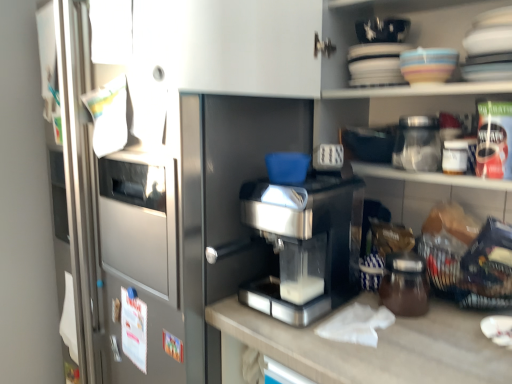
Question: From the image's perspective, relative to matte ceramic bowl at upper right, is transparent glass jar at upper right, placed as the second glass jar when sorted from bottom to top, above or below?

Choices:
 (A) above
 (B) below

Answer: (B)

Question: Looking at the image, does transparent glass jar at upper right, placed as the second glass jar when sorted from bottom to top, seem bigger or smaller compared to matte ceramic bowl at upper right?

Choices:
 (A) big
 (B) small

Answer: (A)

Question: Based on their relative distances, which object is farther from the brown glass jar at lower right, the second glass jar when ordered from top to bottom?

Choices:
 (A) matte ceramic bowl at upper right
 (B) transparent glass jar at upper right, placed as the second glass jar when sorted from bottom to top
 (C) sleek metallic coffee machine at center

Answer: (A)

Question: Based on their relative distances, which object is nearer to the brown glass jar at lower right, which is counted as the 1th glass jar, starting from the bottom?

Choices:
 (A) sleek metallic coffee machine at center
 (B) matte ceramic bowl at upper right
 (C) transparent glass jar at upper right, which is counted as the first glass jar, starting from the top

Answer: (A)